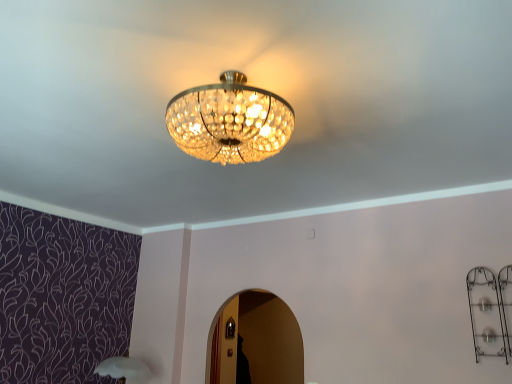
Image resolution: width=512 pixels, height=384 pixels. I want to click on gold reflective mirror at center, so click(x=258, y=340).

Measure the distance between point [236,380] and camera.

Point [236,380] and camera are 3.20 meters apart.

Describe the element at coordinates (258, 340) in the screenshot. This screenshot has height=384, width=512. I see `gold reflective mirror at center` at that location.

Locate an element on the screen. This screenshot has width=512, height=384. gold reflective mirror at center is located at coordinates (258, 340).